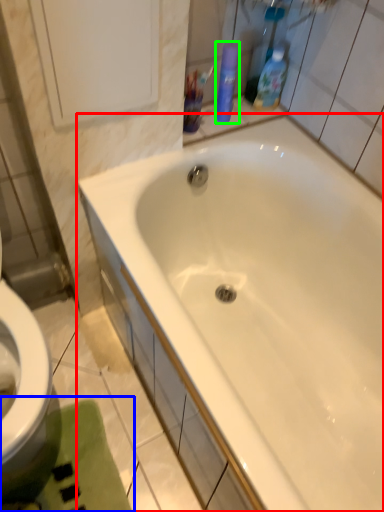
Question: Based on their relative distances, which object is nearer to bathtub (highlighted by a red box)? Choose from bath mat (highlighted by a blue box) and cleaning product (highlighted by a green box).

Choices:
 (A) bath mat
 (B) cleaning product

Answer: (A)